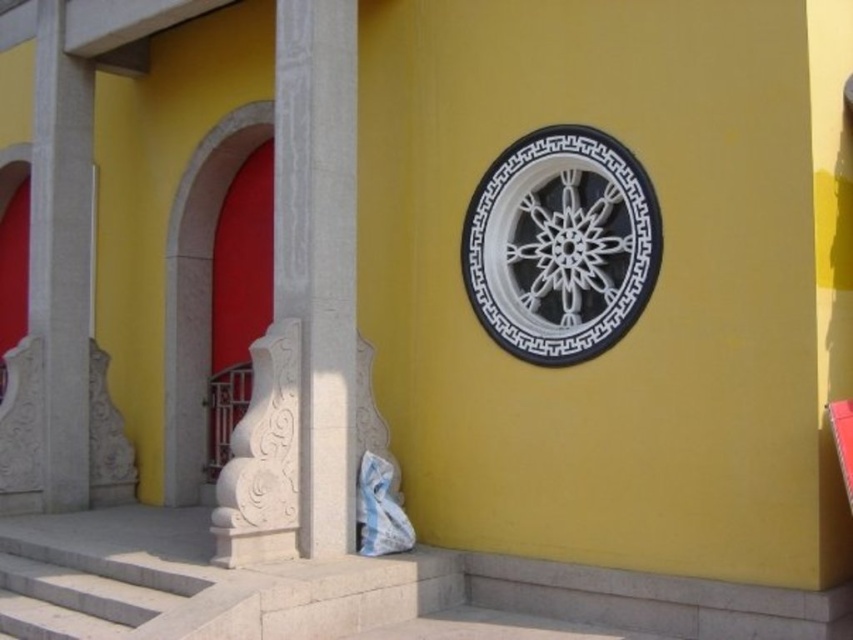
Is white marble pillar at center taller than white marble pillar at left?

No, white marble pillar at center is not taller than white marble pillar at left.

Which of these two, white marble pillar at center or white marble pillar at left, stands taller?

white marble pillar at left is taller.

Locate an element on the screen. white marble pillar at center is located at coordinates (318, 252).